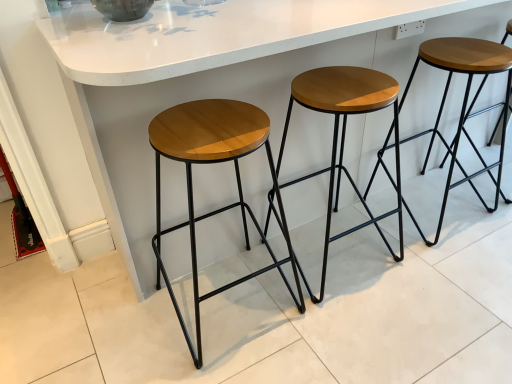
Question: Is white glossy counter at center with wooden seat at center, acting as the 3th stool starting from the left?

Choices:
 (A) no
 (B) yes

Answer: (A)

Question: Is white glossy counter at center positioned with its back to wooden seat at center, arranged as the 1th stool when viewed from the right?

Choices:
 (A) no
 (B) yes

Answer: (A)

Question: Considering the relative sizes of white glossy counter at center and wooden seat at center, arranged as the 1th stool when viewed from the right, in the image provided, is white glossy counter at center taller than wooden seat at center, arranged as the 1th stool when viewed from the right,?

Choices:
 (A) yes
 (B) no

Answer: (A)

Question: Does white glossy counter at center appear on the right side of wooden seat at center, acting as the 3th stool starting from the left?

Choices:
 (A) yes
 (B) no

Answer: (B)

Question: Could wooden seat at center, acting as the 3th stool starting from the left, be considered to be inside white glossy counter at center?

Choices:
 (A) no
 (B) yes

Answer: (B)

Question: Considering the relative sizes of white glossy counter at center and wooden seat at center, arranged as the 1th stool when viewed from the right, in the image provided, is white glossy counter at center thinner than wooden seat at center, arranged as the 1th stool when viewed from the right,?

Choices:
 (A) yes
 (B) no

Answer: (B)

Question: Is wooden seat at center, acting as the 3th stool starting from the left, positioned before white glossy counter at center?

Choices:
 (A) yes
 (B) no

Answer: (B)

Question: Is wooden seat at center, acting as the 3th stool starting from the left, at the right side of white glossy counter at center?

Choices:
 (A) yes
 (B) no

Answer: (A)

Question: From a real-world perspective, is wooden seat at center, acting as the 3th stool starting from the left, physically below white glossy counter at center?

Choices:
 (A) yes
 (B) no

Answer: (A)

Question: From the image's perspective, is wooden seat at center, acting as the 3th stool starting from the left, below white glossy counter at center?

Choices:
 (A) no
 (B) yes

Answer: (B)

Question: Is wooden seat at center, acting as the 3th stool starting from the left, far away from white glossy counter at center?

Choices:
 (A) yes
 (B) no

Answer: (B)

Question: Is white glossy counter at center at the back of wooden seat at center, acting as the 3th stool starting from the left?

Choices:
 (A) no
 (B) yes

Answer: (B)

Question: Does white glossy counter at center lie behind wooden/matte stool at center, marked as the 2th stool in a left-to-right arrangement?

Choices:
 (A) no
 (B) yes

Answer: (A)